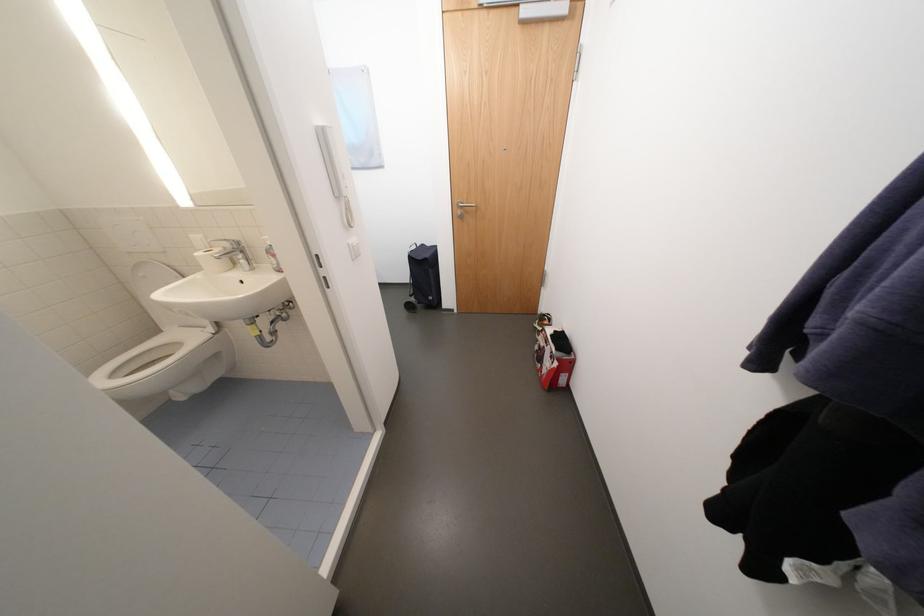
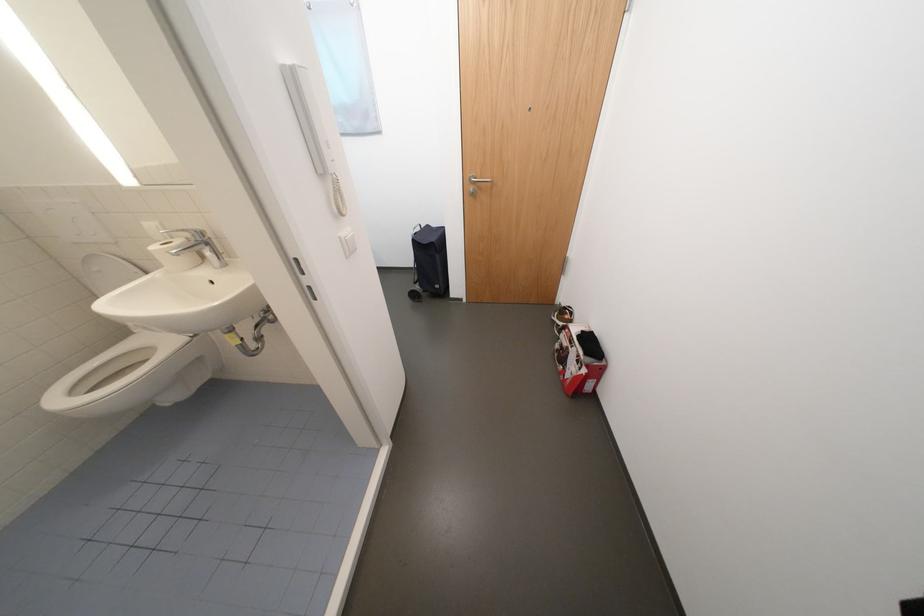
Locate, in the second image, the point that corresponds to (x=357, y=245) in the first image.

(347, 238)